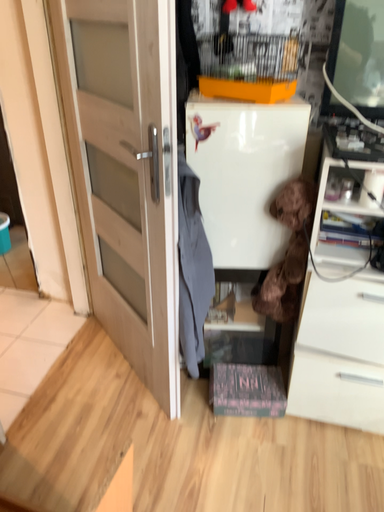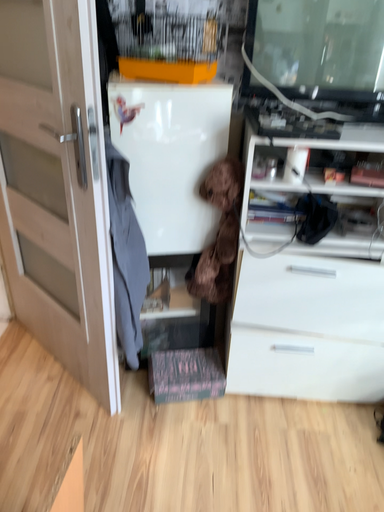
Question: Which way did the camera rotate in the video?

Choices:
 (A) rotated right
 (B) rotated left

Answer: (A)